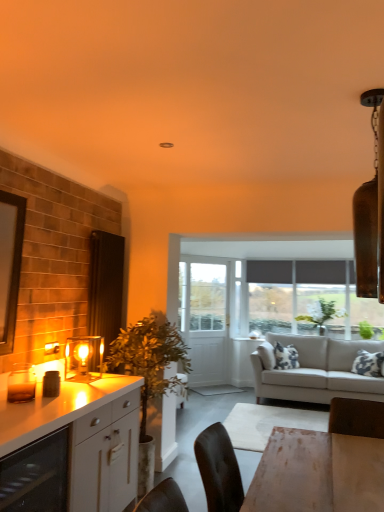
This screenshot has width=384, height=512. I want to click on vacant space behind matte glass lampshade at left, so click(x=91, y=373).